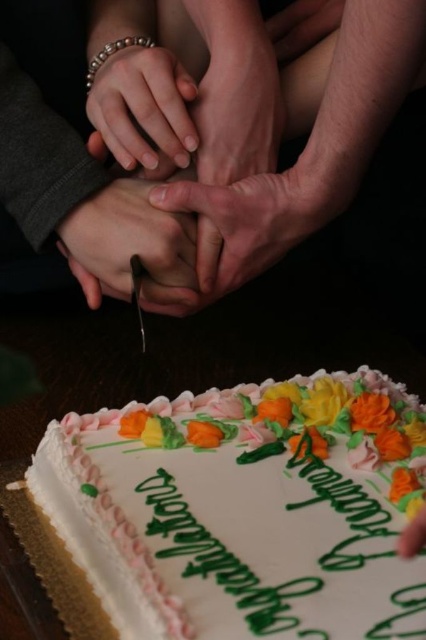
Question: Which point is farther to the camera?

Choices:
 (A) white frosted cake at lower center
 (B) matte gold bracelet at center
 (C) matte skin hands at center
 (D) smooth skin hand at center

Answer: (B)

Question: Is matte skin hand at center to the right of smooth skin hand at center from the viewer's perspective?

Choices:
 (A) no
 (B) yes

Answer: (A)

Question: Which object is farther from the camera taking this photo?

Choices:
 (A) smooth skin hand at center
 (B) matte skin hands at center
 (C) matte skin hand at center
 (D) matte gold bracelet at center

Answer: (D)

Question: Observing the image, what is the correct spatial positioning of matte skin hand at center in reference to matte gold bracelet at center?

Choices:
 (A) above
 (B) below

Answer: (B)

Question: Considering the relative positions of matte skin hands at center and matte gold bracelet at center in the image provided, where is matte skin hands at center located with respect to matte gold bracelet at center?

Choices:
 (A) above
 (B) below

Answer: (B)

Question: Among these objects, which one is farthest from the camera?

Choices:
 (A) matte gold bracelet at center
 (B) matte skin hand at center
 (C) matte skin hands at center
 (D) white frosted cake at lower center

Answer: (A)